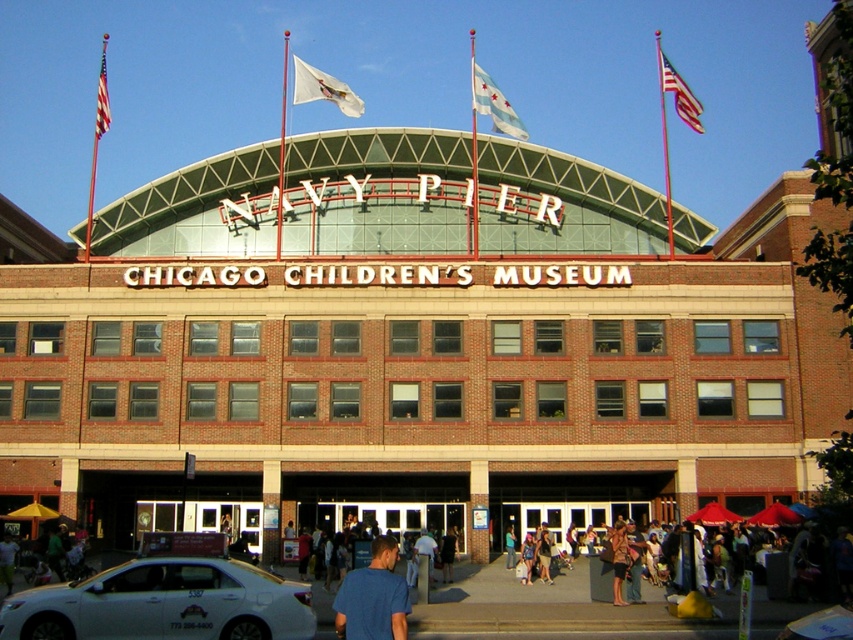
Question: From the image, what is the correct spatial relationship of white fabric flag at upper center in relation to black fabric bag at center?

Choices:
 (A) below
 (B) above

Answer: (B)

Question: Which of the following is the farthest from the observer?

Choices:
 (A) light blue shirt at lower left
 (B) blue denim jeans at center
 (C) blue fabric shirt at center

Answer: (C)

Question: Does blue fabric flag at center appear over blue denim jeans at center?

Choices:
 (A) no
 (B) yes

Answer: (B)

Question: Is blue t-shirt at center to the right of american flag at upper right from the viewer's perspective?

Choices:
 (A) no
 (B) yes

Answer: (A)

Question: Considering the real-world distances, which object is farthest from the denim shorts at center?

Choices:
 (A) blue fabric flag at center
 (B) blue fabric shirt at center
 (C) light blue shirt at lower left

Answer: (A)

Question: Which point is farther to the camera?

Choices:
 (A) (352, 616)
 (B) (103, 42)
 (C) (670, 70)
 (D) (489, 99)

Answer: (B)